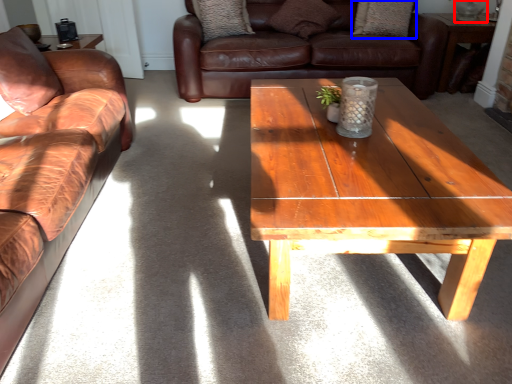
Question: Which point is closer to the camera, glass vase (highlighted by a red box) or pillow (highlighted by a blue box)?

Choices:
 (A) glass vase
 (B) pillow

Answer: (A)